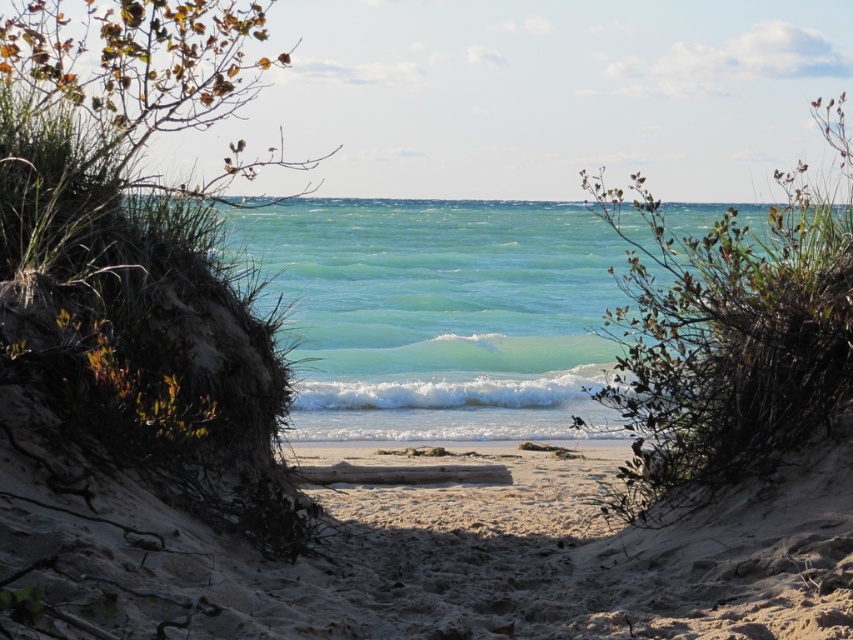
From the picture: You are planning to build a small sandcastle on the white sandy beach at center. Considering the proximity to the translucent teal water at center, how much space do you have before the water reaches your sandcastle?

The translucent teal water at center is wider than the white sandy beach at center, so the sandcastle would be closer to the water edge, leaving limited space before the water reaches it.

You are standing on the white sandy beach at center and want to reach the translucent teal water at center. Which direction should you walk to get there?

The translucent teal water at center is located above the white sandy beach at center, so you should walk forward towards the translucent teal water at center to reach it.